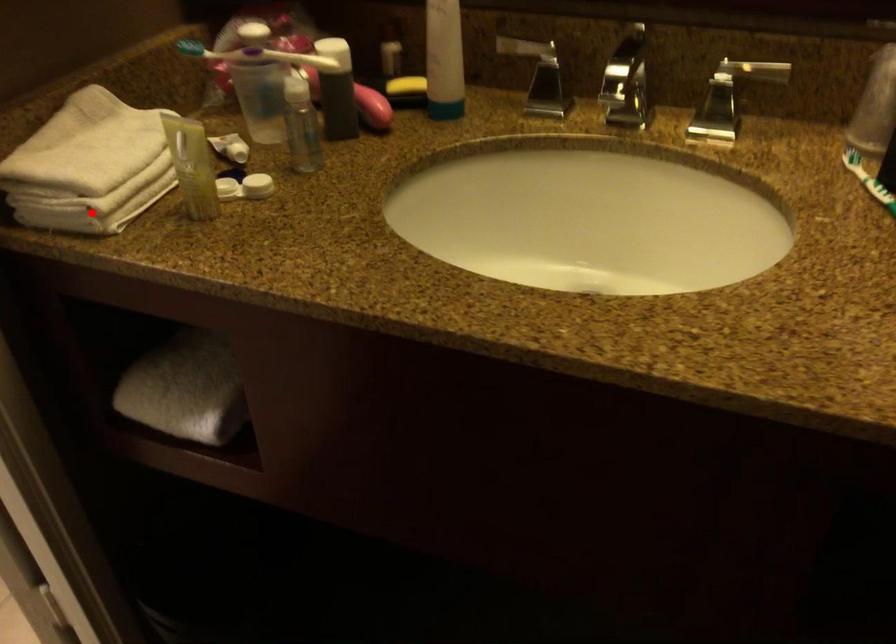
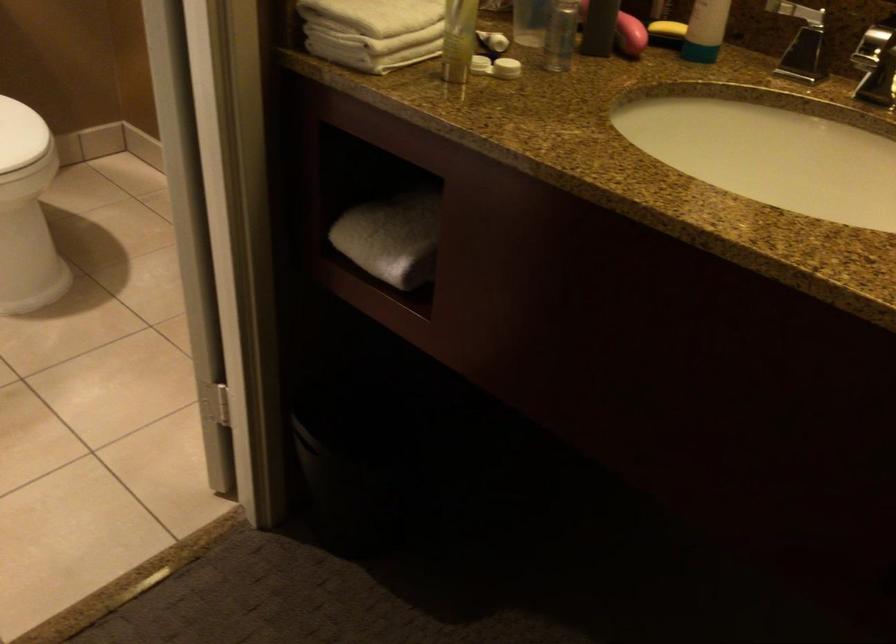
The point at the highlighted location is marked in the first image. Where is the corresponding point in the second image?

(366, 51)